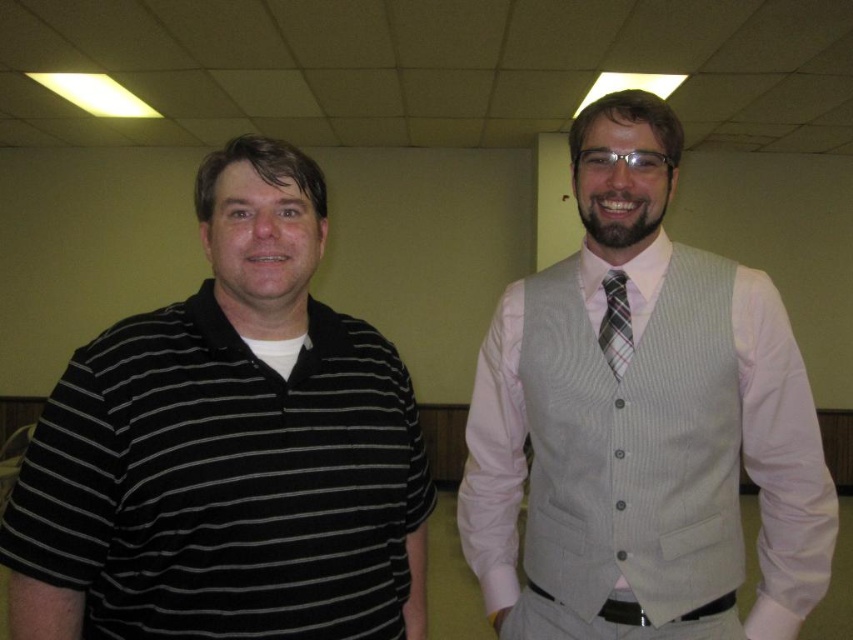
Which of these two, light gray textured vest at right or plaid fabric tie at center, stands taller?

Standing taller between the two is light gray textured vest at right.

Between light gray textured vest at right and plaid fabric tie at center, which one appears on the right side from the viewer's perspective?

light gray textured vest at right

Who is more distant from viewer, [664,356] or [622,337]?

Point [622,337]

I want to click on light gray textured vest at right, so click(634, 445).

Between light gray textured vest at center and light gray textured vest at right, which one has less height?

light gray textured vest at right

Does point (474, 465) lie in front of point (537, 468)?

No, (474, 465) is behind (537, 468).

The height and width of the screenshot is (640, 853). Find the location of `light gray textured vest at center`. light gray textured vest at center is located at coordinates (642, 419).

Is point (480, 442) farther from camera compared to point (618, 330)?

Yes, it is.

Image resolution: width=853 pixels, height=640 pixels. Describe the element at coordinates (642, 419) in the screenshot. I see `light gray textured vest at center` at that location.

Describe the element at coordinates (642, 419) in the screenshot. I see `light gray textured vest at center` at that location.

Locate an element on the screen. light gray textured vest at center is located at coordinates (642, 419).